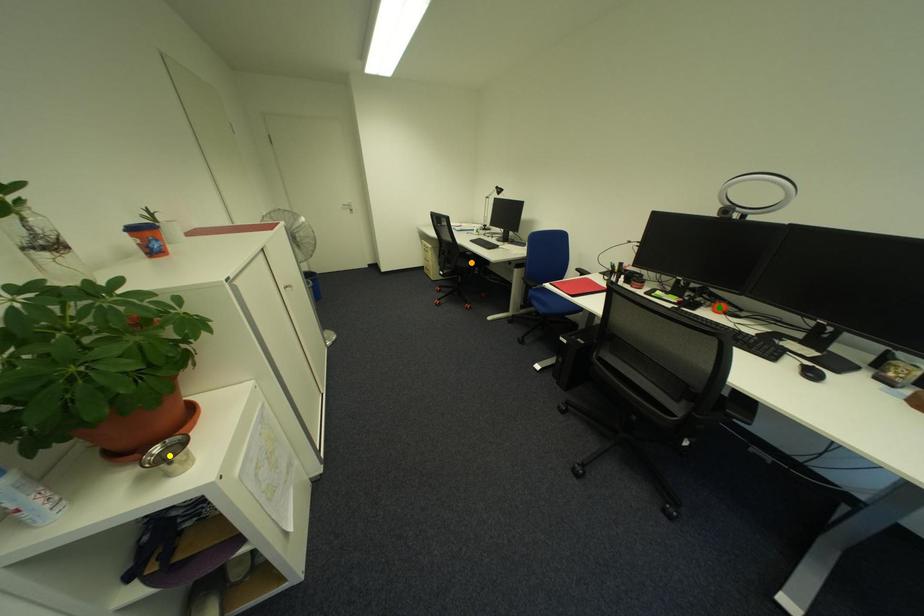
Order these from nearest to farthest:
green point | yellow point | orange point

yellow point, green point, orange point